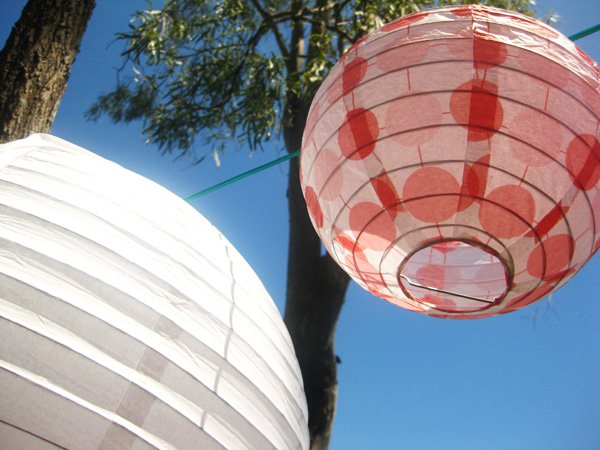
Find the location of a particular element. white lantern is located at coordinates (107, 338).